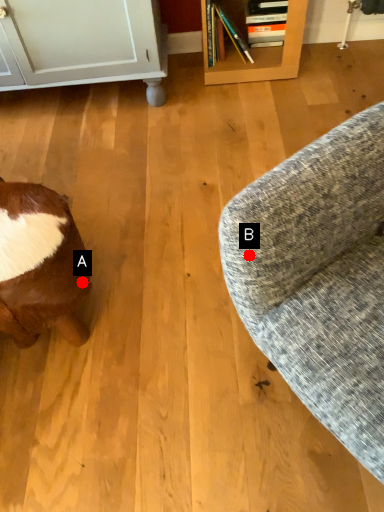
Question: Two points are circled on the image, labeled by A and B beside each circle. Which point is farther to the camera?

Choices:
 (A) A is further
 (B) B is further

Answer: (A)